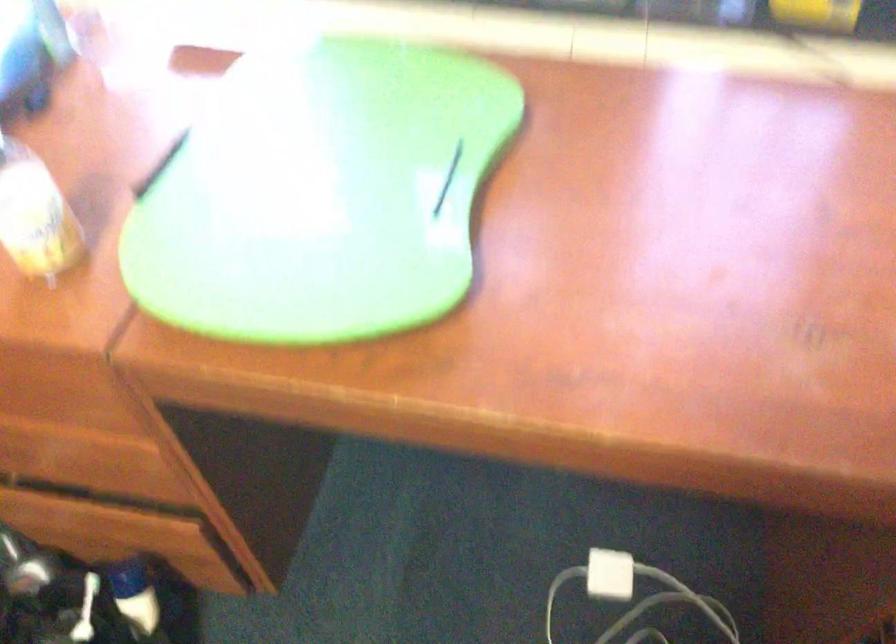
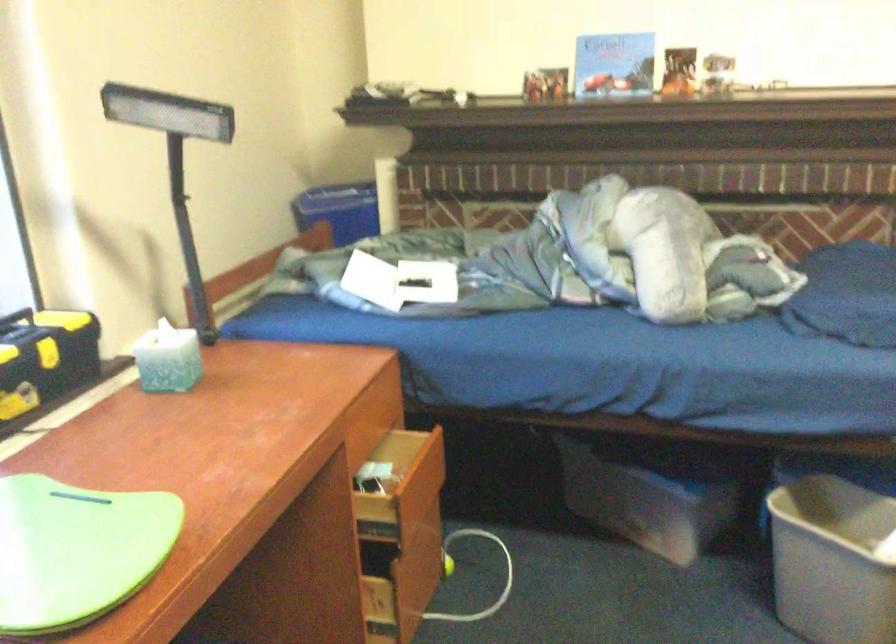
Where in the second image is the point corresponding to point 319,254 from the first image?

(76, 550)